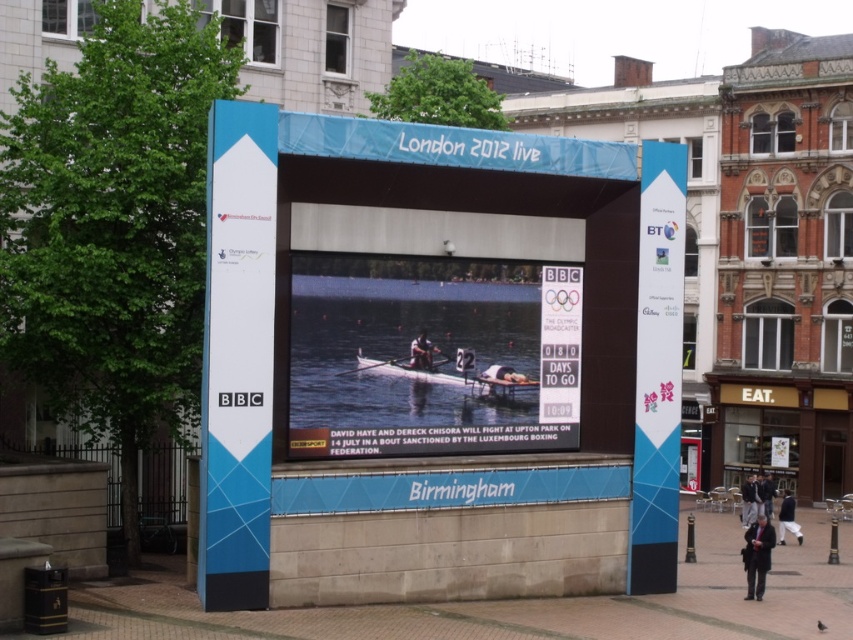
Question: Which of the following is the farthest from the observer?

Choices:
 (A) wooden smooth paddle at center
 (B) matte black rowing boat at center

Answer: (B)

Question: Which point appears farthest from the camera in this image?

Choices:
 (A) (746, 579)
 (B) (763, 506)
 (C) (466, 362)

Answer: (B)

Question: Which point appears closest to the camera in this image?

Choices:
 (A) (764, 483)
 (B) (750, 490)
 (C) (413, 340)

Answer: (C)

Question: Is blue plastic sign at right wider than matte black rower at center?

Choices:
 (A) yes
 (B) no

Answer: (A)

Question: Is blue plastic bus stop at center above dark blue jacket at lower right?

Choices:
 (A) no
 (B) yes

Answer: (B)

Question: From the image, what is the correct spatial relationship of blue plastic sign at right in relation to dark blue jacket at lower right?

Choices:
 (A) left
 (B) right

Answer: (A)